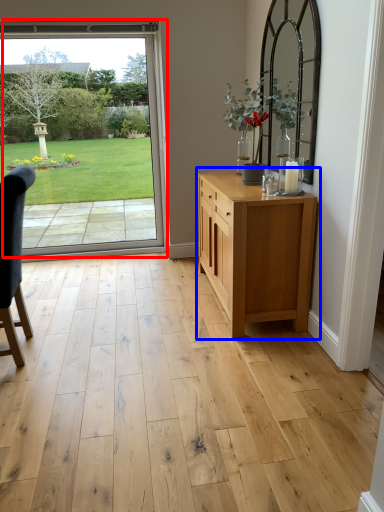
Question: Which of the following is the farthest to the observer, door (highlighted by a red box) or chest of drawers (highlighted by a blue box)?

Choices:
 (A) door
 (B) chest of drawers

Answer: (A)